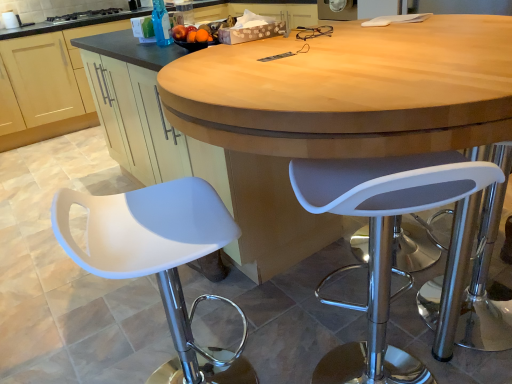
What are the coordinates of `free point behind white plastic stool at right, marked as the 2th chair in a left-to-right arrangement` in the screenshot? It's located at (339, 316).